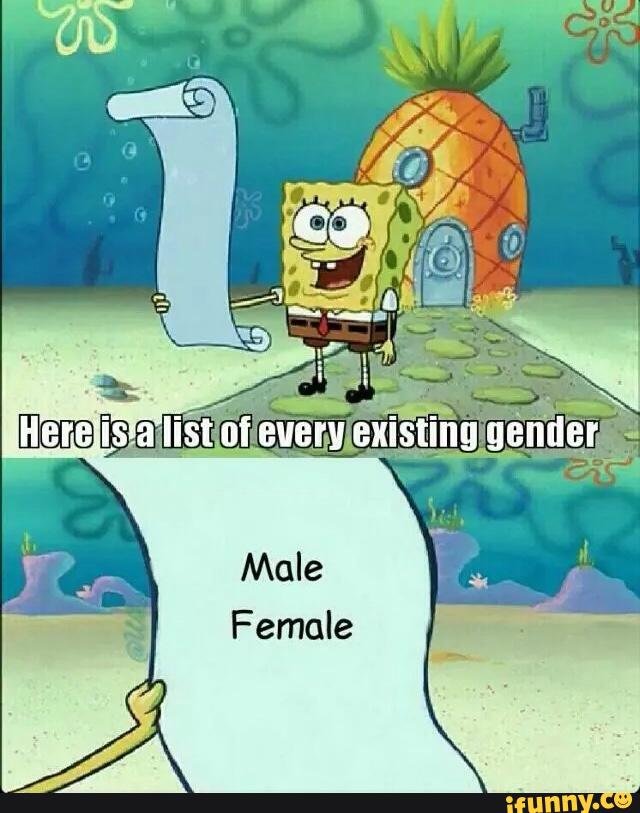
Locate an element on the screen. The image size is (640, 813). window is located at coordinates (411, 167).